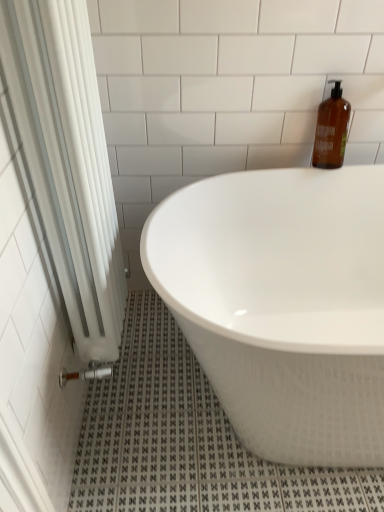
Question: From the image's perspective, is amber glass bottle at upper right positioned above or below white glossy bathtub at center?

Choices:
 (A) above
 (B) below

Answer: (A)

Question: Based on their positions, is amber glass bottle at upper right located to the left or right of white glossy bathtub at center?

Choices:
 (A) right
 (B) left

Answer: (A)

Question: Based on their relative distances, which object is farther from the amber glass bottle at upper right?

Choices:
 (A) white fabric shower curtain at left
 (B) white glossy bathtub at center

Answer: (A)

Question: Considering the real-world distances, which object is closest to the white glossy bathtub at center?

Choices:
 (A) white fabric shower curtain at left
 (B) amber glass bottle at upper right

Answer: (A)